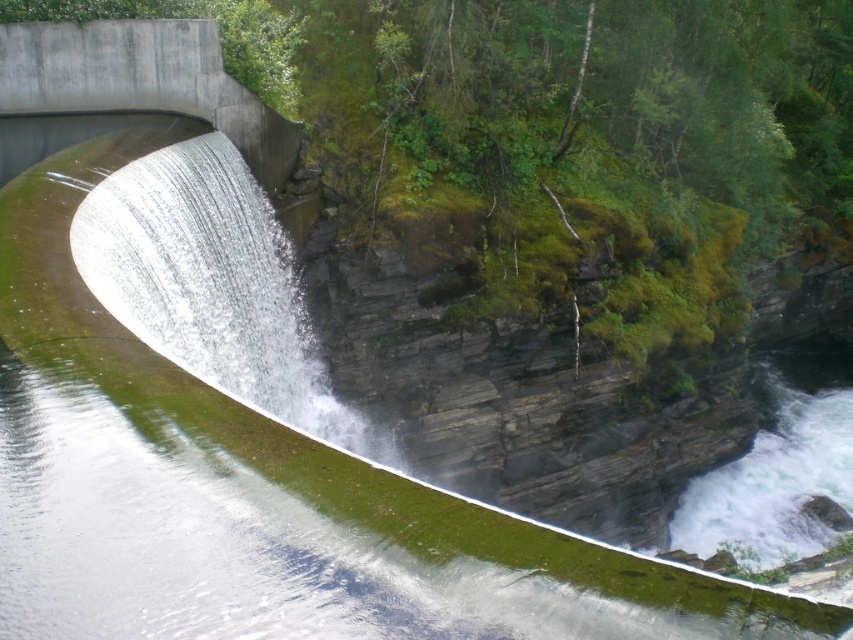
You are a hiker who just crossed the concrete bridge at upper left and want to reach the clear water at center. Which direction should you head towards?

The clear water at center is located below the concrete bridge at upper left, so you should head downward from the concrete bridge at upper left to reach the clear water at center.

You are a maintenance worker needing to cross from the clear water at center to the concrete bridge at upper left. Given that your equipment can only safely cross gaps up to 5 meters, can you safely make this crossing?

The distance between the clear water at center and the concrete bridge at upper left is 5.60 meters. Since the equipment can only safely cross gaps up to 5 meters, the worker cannot safely make this crossing as the gap is wider than the safe limit.